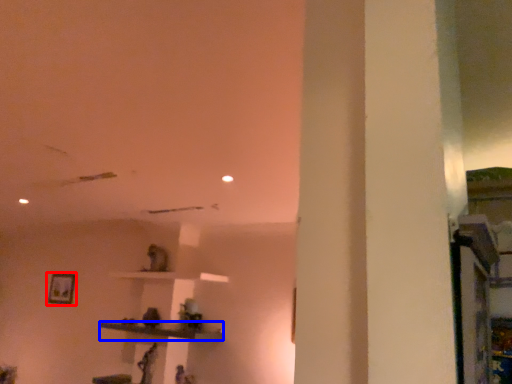
Question: Among these objects, which one is farthest to the camera, picture frame (highlighted by a red box) or furniture (highlighted by a blue box)?

Choices:
 (A) picture frame
 (B) furniture

Answer: (A)